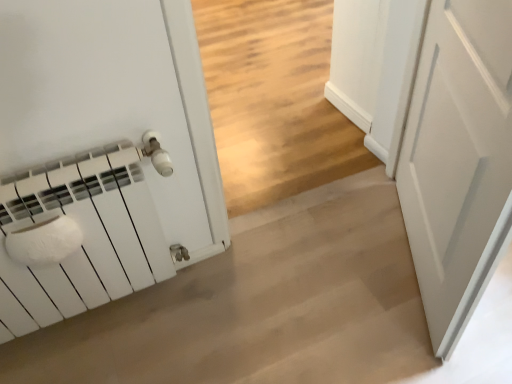
Where is `free region on the left part of white matte door at right`? free region on the left part of white matte door at right is located at coordinates pyautogui.click(x=309, y=281).